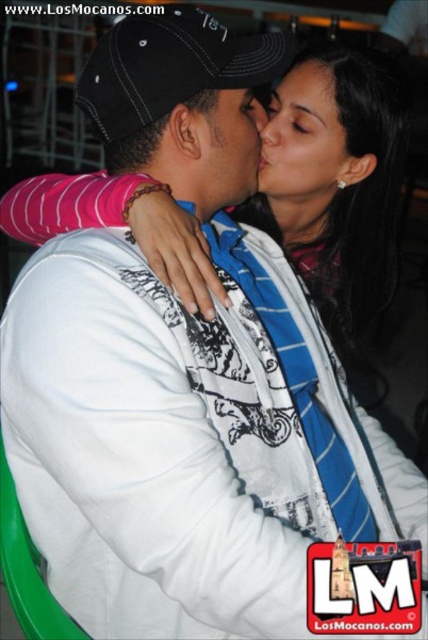
You are a photographer adjusting the focus of your camera. The camera has a depth of field that can clearly capture objects within 7 centimeters. You want to ensure both the smooth skin face at center and the smooth skin forehead at upper center are in focus. Can you achieve this with the current settings?

The smooth skin face at center is 7.25 centimeters from the smooth skin forehead at upper center. Since the depth of field can only capture objects within 7 centimeters, the distance between them exceeds the camera setting. Therefore, both cannot be in focus simultaneously.

You are a photographer trying to capture the details of the smooth skin face at center and the matte black cap at center in this nighttime scene. Since the background is blurred, you want to ensure both subjects are in focus. If the camera can only focus on one object at a time, which object should you choose to focus on to ensure the larger one is sharp?

The smooth skin face at center is larger in size than the matte black cap at center, so you should focus on the smooth skin face at center to ensure the larger object is sharp.

Based on the scene description, where is the point at coordinates (303, 138) located?

The point at coordinates (303, 138) is located on the smooth skin face at center.